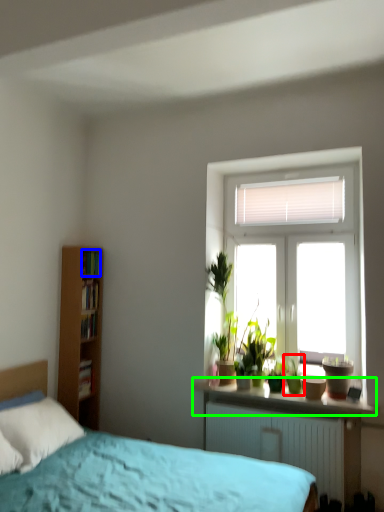
Question: Estimate the real-world distances between objects in this image. Which object is closer to houseplant (highlighted by a red box), book (highlighted by a blue box) or window sill (highlighted by a green box)?

Choices:
 (A) book
 (B) window sill

Answer: (B)